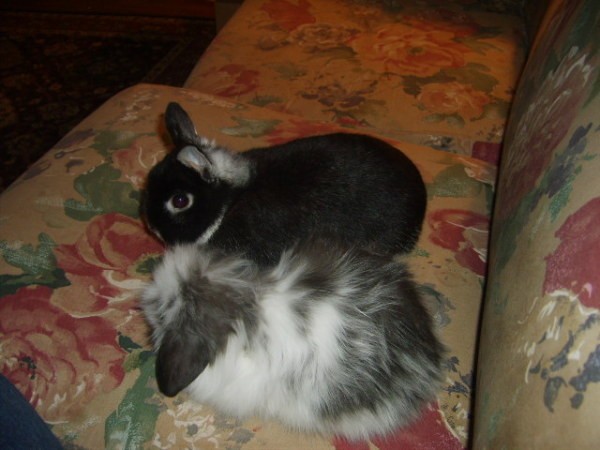
Where is `sticking out couch part`? sticking out couch part is located at coordinates (48, 179).